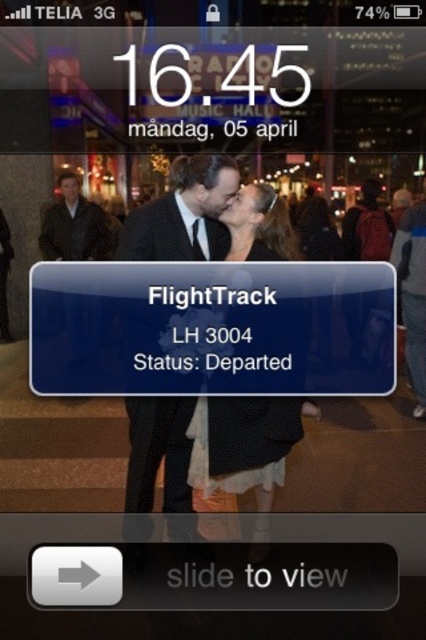
You are trying to unlock your phone and accidentally touched the screen. The point you touched is at coordinates point (184,212). Based on the scene, what object did you touch?

The point (184,212) is on black suit at center.

You are a fashion designer analyzing the lock screen image. You see the black suit at center and the black silk suit at center. Which one is wider?

The black suit at center is wider than the black silk suit at center according to the description.